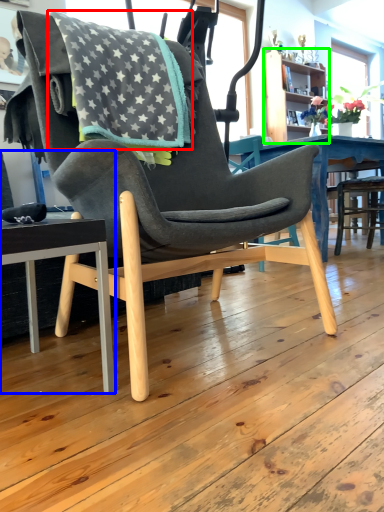
Question: Estimate the real-world distances between objects in this image. Which object is closer to blanket (highlighted by a red box), chair (highlighted by a blue box) or bookshelf (highlighted by a green box)?

Choices:
 (A) chair
 (B) bookshelf

Answer: (A)